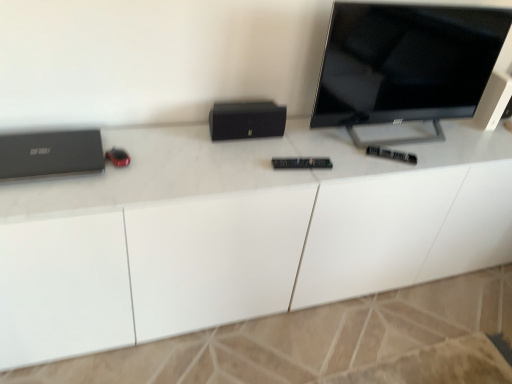
What are the coordinates of `free location in front of black matte speaker at center` in the screenshot? It's located at (238, 163).